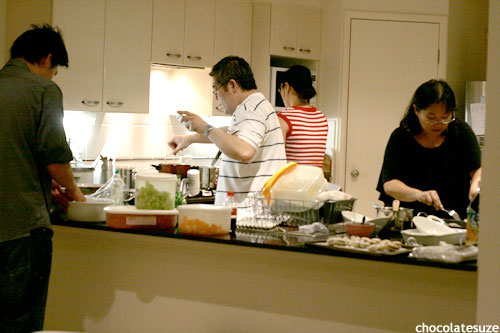
Locate an element on the screen. This screenshot has height=333, width=500. counter is located at coordinates (169, 273).